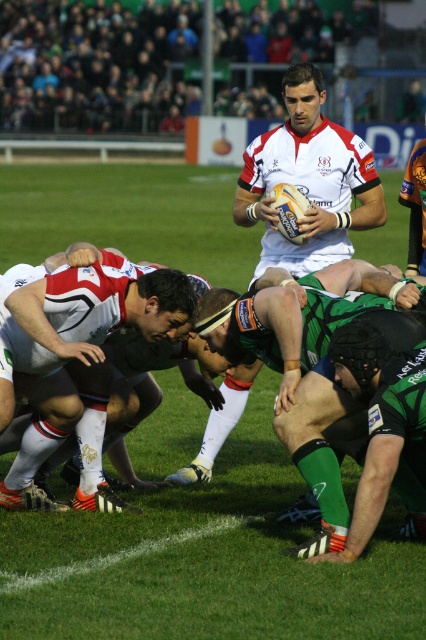
You are a sports analyst watching the rugby scrum. You notice two green jerseys in the image. Based on their sizes, which one is more likely to belong to a forward player, the green fabric jersey at center or the green jersey at lower right?

The green fabric jersey at center is larger in size than the green jersey at lower right, so it is more likely to belong to a forward player since forwards typically wear larger jerseys to handle physical play.

You are a referee observing the rugby scrum. You need to determine if the ball is correctly positioned according to the rules, which require the ball to be in front of all players. Based on the image, is the white matte rugby ball at center positioned correctly relative to the green jersey at lower right?

The white matte rugby ball at center is further to the viewer than the green jersey at lower right, so it is positioned correctly in front of the green jersey at lower right according to the rules.

You are a referee observing the scrum. You notice two players wearing green jerseys. The first is the green fabric jersey at center and the second is the green jersey at lower right. Which player is positioned further to the left side of the scrum?

The green fabric jersey at center is positioned further to the left than the green jersey at lower right.